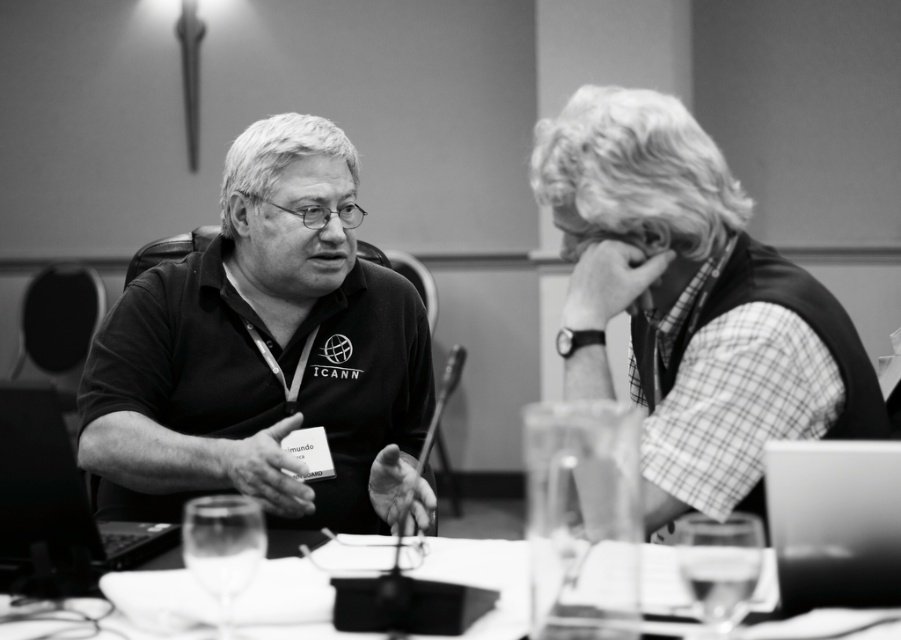
You are attending a virtual meeting and need to share your screen. You see the checkered fabric shirt at right and the metallic silver laptop at lower right. Which object is closer to you, the viewer?

The checkered fabric shirt at right is closer to you than the metallic silver laptop at lower right because the laptop is positioned behind the shirt.

You are a photographer who needs to capture a closeup of the checkered fabric shirt at right and the metallic silver laptop at lower right. Since you can only focus on one object at a time, which one should you focus on first if you want to ensure both are in focus without moving the camera?

The checkered fabric shirt at right is located above the metallic silver laptop at lower right. Since the camera can only focus on one plane at a time, focusing on the checkered fabric shirt at right first would allow the metallic silver laptop at lower right to be in focus as well, as it is closer to the camera than the shirt.